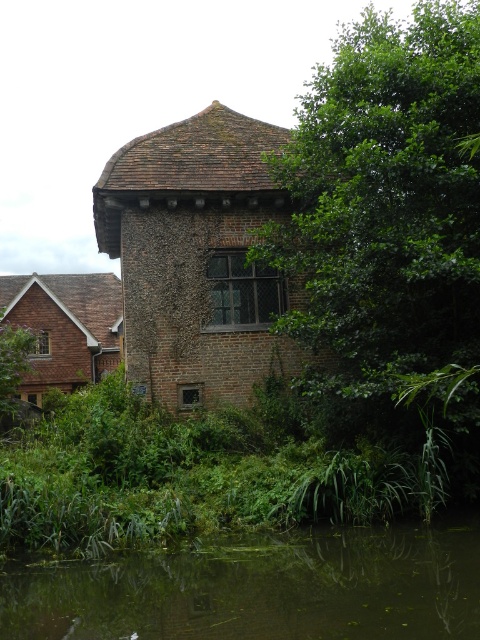
Can you confirm if green leafy tree at center is shorter than green mossy water at lower center?

No.

Between green leafy tree at center and green mossy water at lower center, which one has more height?

green leafy tree at center is taller.

Locate an element on the screen. Image resolution: width=480 pixels, height=640 pixels. green leafy tree at center is located at coordinates (385, 202).

The width and height of the screenshot is (480, 640). In order to click on green leafy tree at center in this screenshot , I will do `click(385, 202)`.